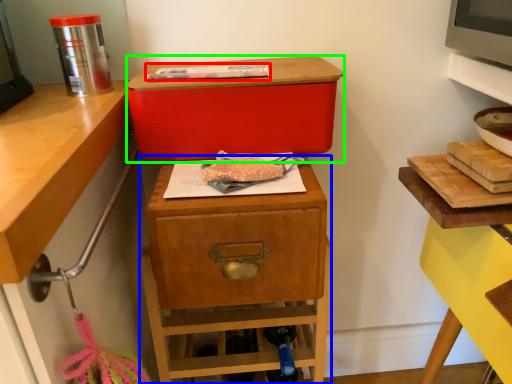
Question: Which object is positioned farthest from food (highlighted by a red box)? Select from nightstand (highlighted by a blue box) and storage box (highlighted by a green box).

Choices:
 (A) nightstand
 (B) storage box

Answer: (A)